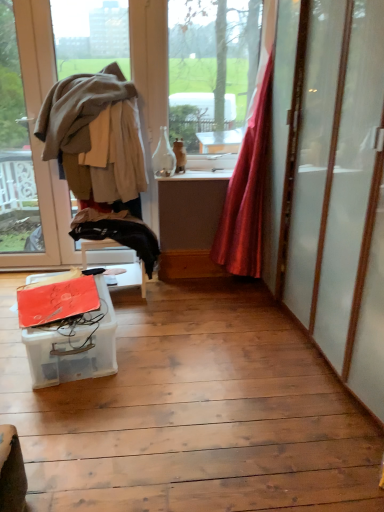
Describe the element at coordinates (35, 50) in the screenshot. I see `matte beige window at left` at that location.

Describe the element at coordinates (249, 176) in the screenshot. The height and width of the screenshot is (512, 384). I see `silky red curtain at right` at that location.

This screenshot has width=384, height=512. Identify the location of light brown fabric at left. (89, 132).

Which object is closer to the camera taking this photo, translucent plastic container at lower left or light brown fabric at left?

translucent plastic container at lower left is in front.

Considering the relative sizes of translucent plastic container at lower left and light brown fabric at left in the image provided, is translucent plastic container at lower left taller than light brown fabric at left?

In fact, translucent plastic container at lower left may be shorter than light brown fabric at left.

Which of these two, translucent plastic container at lower left or light brown fabric at left, is bigger?

light brown fabric at left.

Identify the location of curtain beneath the light brown fabric at left (from a real-world perspective). This screenshot has width=384, height=512. (249, 176).

Is silky red curtain at right inside the boundaries of light brown fabric at left, or outside?

silky red curtain at right is not inside light brown fabric at left, it's outside.

Considering the sizes of silky red curtain at right and light brown fabric at left in the image, is silky red curtain at right wider or thinner than light brown fabric at left?

Considering their sizes, silky red curtain at right looks slimmer than light brown fabric at left.

Is silky red curtain at right looking in the opposite direction of light brown fabric at left?

That's not correct — silky red curtain at right is not looking away from light brown fabric at left.

Based on the photo, is matte beige window at left aimed at silky red curtain at right?

No, matte beige window at left does not turn towards silky red curtain at right.

In terms of size, does matte beige window at left appear bigger or smaller than silky red curtain at right?

Clearly, matte beige window at left is smaller in size than silky red curtain at right.

Which of these two, matte beige window at left or silky red curtain at right, stands shorter?

With less height is silky red curtain at right.

Can you confirm if matte beige window at left is wider than light brown fabric at left?

Incorrect, the width of matte beige window at left does not surpass that of light brown fabric at left.

Locate an element on the screen. The height and width of the screenshot is (512, 384). window on the left of light brown fabric at left is located at coordinates (35, 50).

Is matte beige window at left in front of or behind light brown fabric at left in the image?

Visually, matte beige window at left is located behind light brown fabric at left.

Can you confirm if light brown fabric at left is shorter than silky red curtain at right?

Yes, light brown fabric at left is shorter than silky red curtain at right.

From the image's perspective, is light brown fabric at left positioned above or below silky red curtain at right?

light brown fabric at left is above silky red curtain at right.

Is light brown fabric at left aimed at silky red curtain at right?

No, light brown fabric at left is not facing towards silky red curtain at right.

Which object is wider, light brown fabric at left or silky red curtain at right?

light brown fabric at left.

Consider the image. Is silky red curtain at right completely or partially outside of matte beige window at left?

Absolutely, silky red curtain at right is external to matte beige window at left.

From the image's perspective, is silky red curtain at right located above matte beige window at left?

Actually, silky red curtain at right appears below matte beige window at left in the image.

Can you confirm if silky red curtain at right is wider than matte beige window at left?

Indeed, silky red curtain at right has a greater width compared to matte beige window at left.

From the image's perspective, is matte beige window at left above or below translucent plastic container at lower left?

matte beige window at left is above translucent plastic container at lower left.

Considering the sizes of objects matte beige window at left and translucent plastic container at lower left in the image provided, who is shorter, matte beige window at left or translucent plastic container at lower left?

translucent plastic container at lower left.

You are a GUI agent. You are given a task and a screenshot of the screen. Output one action in this format:
    pyautogui.click(x=<x>, y=<y>)
    Task: Click on the window to the left of translucent plastic container at lower left
    Image resolution: width=384 pixels, height=512 pixels.
    Given the screenshot: What is the action you would take?
    pyautogui.click(x=35, y=50)

How different are the orientations of matte beige window at left and translucent plastic container at lower left in degrees?

matte beige window at left and translucent plastic container at lower left are facing 12.5 degrees away from each other.

Identify the location of table on the left side of light brown fabric at left. The width and height of the screenshot is (384, 512). (74, 345).

What are the coordinates of `clothing above the silky red curtain at right (from the image's perspective)` in the screenshot? It's located at (89, 132).

Which object lies nearer to the anchor point matte beige window at left, silky red curtain at right or light brown fabric at left?

light brown fabric at left lies closer to matte beige window at left than the other object.

Consider the image. From the image, which object appears to be nearer to light brown fabric at left, silky red curtain at right or translucent plastic container at lower left?

Among the two, silky red curtain at right is located nearer to light brown fabric at left.

From the image, which object appears to be nearer to translucent plastic container at lower left, matte beige window at left or light brown fabric at left?

light brown fabric at left is positioned closer to the anchor translucent plastic container at lower left.

Considering their positions, is light brown fabric at left positioned closer to translucent plastic container at lower left than silky red curtain at right?

The object closer to translucent plastic container at lower left is light brown fabric at left.

Which object lies further to the anchor point translucent plastic container at lower left, silky red curtain at right or light brown fabric at left?

silky red curtain at right is positioned further to the anchor translucent plastic container at lower left.

Looking at the image, which one is located further to silky red curtain at right, translucent plastic container at lower left or light brown fabric at left?

Based on the image, translucent plastic container at lower left appears to be further to silky red curtain at right.

From the image, which object appears to be nearer to light brown fabric at left, matte beige window at left or translucent plastic container at lower left?

matte beige window at left lies closer to light brown fabric at left than the other object.

Considering their positions, is silky red curtain at right positioned closer to light brown fabric at left than matte beige window at left?

Among the two, matte beige window at left is located nearer to light brown fabric at left.

At what (x,y) coordinates should I click in order to perform the action: click on clothing located between matte beige window at left and silky red curtain at right in the left-right direction. Please return your answer as a coordinate pair (x, y). Looking at the image, I should click on (89, 132).

At what (x,y) coordinates should I click in order to perform the action: click on curtain between light brown fabric at left and translucent plastic container at lower left in the up-down direction. Please return your answer as a coordinate pair (x, y). Looking at the image, I should click on (249, 176).

At what (x,y) coordinates should I click in order to perform the action: click on table between matte beige window at left and silky red curtain at right in the horizontal direction. Please return your answer as a coordinate pair (x, y). Looking at the image, I should click on (74, 345).

This screenshot has height=512, width=384. What are the coordinates of `window between light brown fabric at left and translucent plastic container at lower left vertically` in the screenshot? It's located at (35, 50).